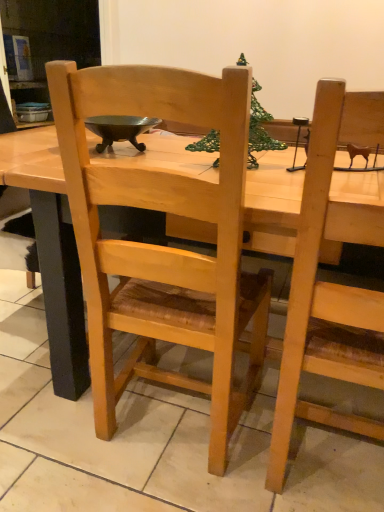
Question: Could you tell me if natural wood chair at center is facing wooden table at center?

Choices:
 (A) no
 (B) yes

Answer: (B)

Question: Does natural wood chair at center have a greater height compared to wooden table at center?

Choices:
 (A) yes
 (B) no

Answer: (A)

Question: Considering the relative positions of natural wood chair at center and wooden table at center in the image provided, is natural wood chair at center to the left of wooden table at center from the viewer's perspective?

Choices:
 (A) no
 (B) yes

Answer: (A)

Question: Does natural wood chair at center touch wooden table at center?

Choices:
 (A) yes
 (B) no

Answer: (B)

Question: Does natural wood chair at center have a lesser height compared to wooden table at center?

Choices:
 (A) no
 (B) yes

Answer: (A)

Question: Can you confirm if natural wood chair at center is positioned to the right of wooden table at center?

Choices:
 (A) no
 (B) yes

Answer: (B)

Question: Could you tell me if wooden table at center is turned towards natural wood chair at center?

Choices:
 (A) yes
 (B) no

Answer: (A)

Question: From a real-world perspective, is wooden table at center physically below natural wood chair at center?

Choices:
 (A) yes
 (B) no

Answer: (A)

Question: Is wooden table at center located outside natural wood chair at center?

Choices:
 (A) yes
 (B) no

Answer: (A)

Question: Is wooden table at center smaller than natural wood chair at center?

Choices:
 (A) no
 (B) yes

Answer: (A)

Question: Can you confirm if wooden table at center is positioned to the left of natural wood chair at center?

Choices:
 (A) no
 (B) yes

Answer: (B)

Question: Considering the relative sizes of wooden table at center and natural wood chair at center in the image provided, is wooden table at center wider than natural wood chair at center?

Choices:
 (A) no
 (B) yes

Answer: (B)

Question: In the image, is natural wood chair at center positioned in front of or behind wooden table at center?

Choices:
 (A) behind
 (B) front

Answer: (B)